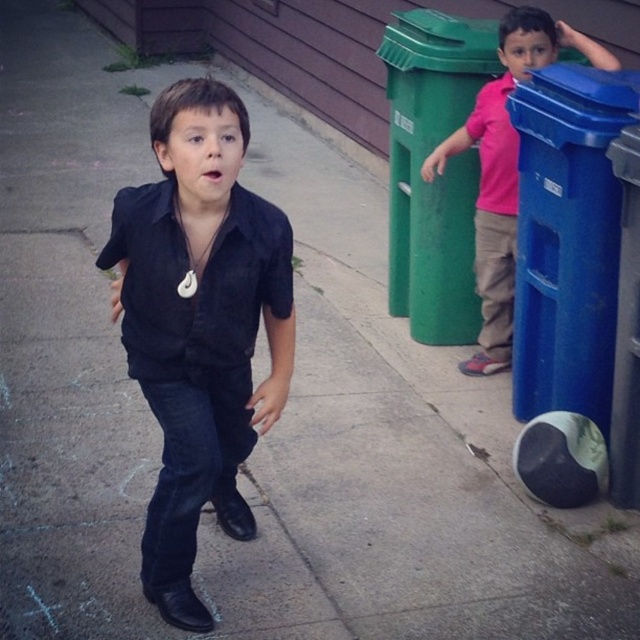
Question: Which of these objects is positioned closest to the pink fabric shirt at right?

Choices:
 (A) matte black shirt at center
 (B) brushed metal curb at center
 (C) blue plastic recycling bin at right
 (D) green plastic curb at upper center

Answer: (C)

Question: Which is farther from the brushed metal curb at center?

Choices:
 (A) pink fabric shirt at right
 (B) green plastic curb at upper center
 (C) matte black shirt at center
 (D) blue plastic recycling bin at right

Answer: (C)

Question: Where is matte black shirt at center located in relation to green plastic curb at upper center in the image?

Choices:
 (A) right
 (B) left

Answer: (B)

Question: Is blue plastic recycling bin at right smaller than pink fabric shirt at right?

Choices:
 (A) yes
 (B) no

Answer: (A)

Question: Does matte black shirt at center appear over brushed metal curb at center?

Choices:
 (A) yes
 (B) no

Answer: (B)

Question: Which object appears farthest from the camera in this image?

Choices:
 (A) brushed metal curb at center
 (B) green plastic curb at upper center
 (C) pink fabric shirt at right

Answer: (A)